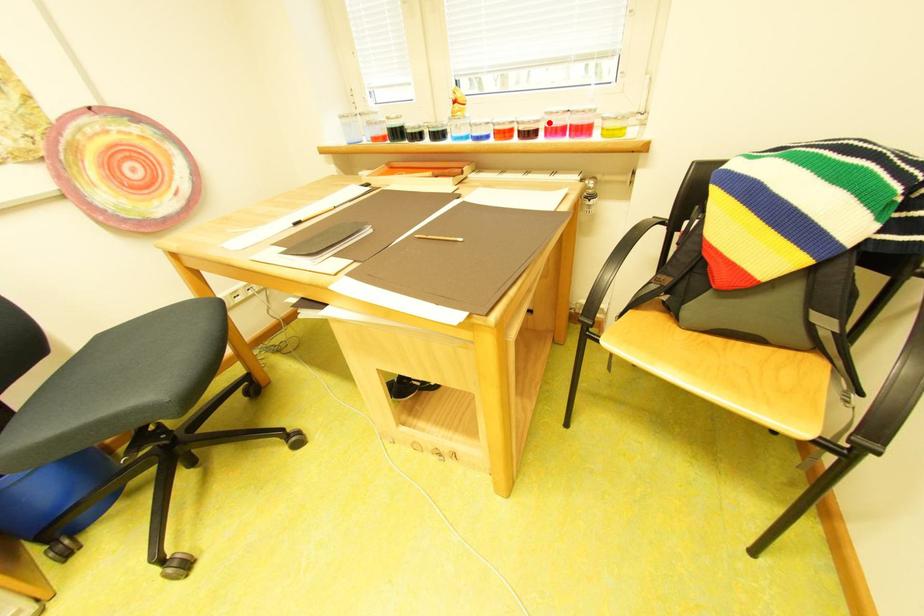
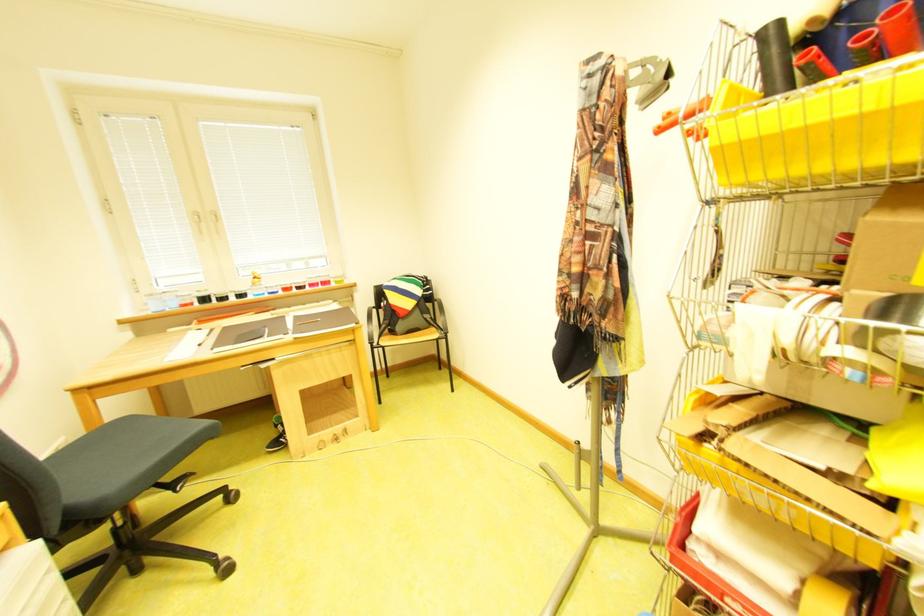
Where in the second image is the point corresponding to the highlighted location from the first image?

(315, 283)